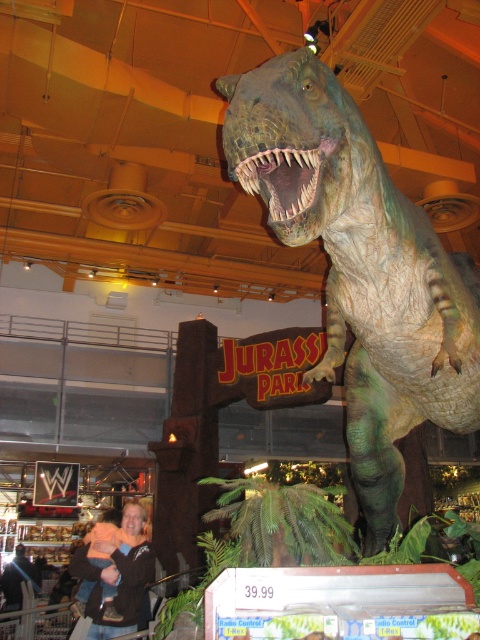
Question: Is green textured dinosaur at center bigger than dark brown leather jacket at lower left?

Choices:
 (A) no
 (B) yes

Answer: (B)

Question: Is green textured dinosaur at center to the left of dark brown leather jacket at lower left from the viewer's perspective?

Choices:
 (A) yes
 (B) no

Answer: (B)

Question: Which point is closer to the camera?

Choices:
 (A) (266, 80)
 (B) (117, 556)

Answer: (A)

Question: Does green textured dinosaur at center appear on the left side of dark brown leather jacket at lower left?

Choices:
 (A) no
 (B) yes

Answer: (A)

Question: Which point is closer to the camera?

Choices:
 (A) dark brown leather jacket at lower left
 (B) green textured dinosaur at center

Answer: (B)

Question: Among these objects, which one is nearest to the camera?

Choices:
 (A) green textured dinosaur at center
 (B) dark brown leather jacket at lower left

Answer: (A)